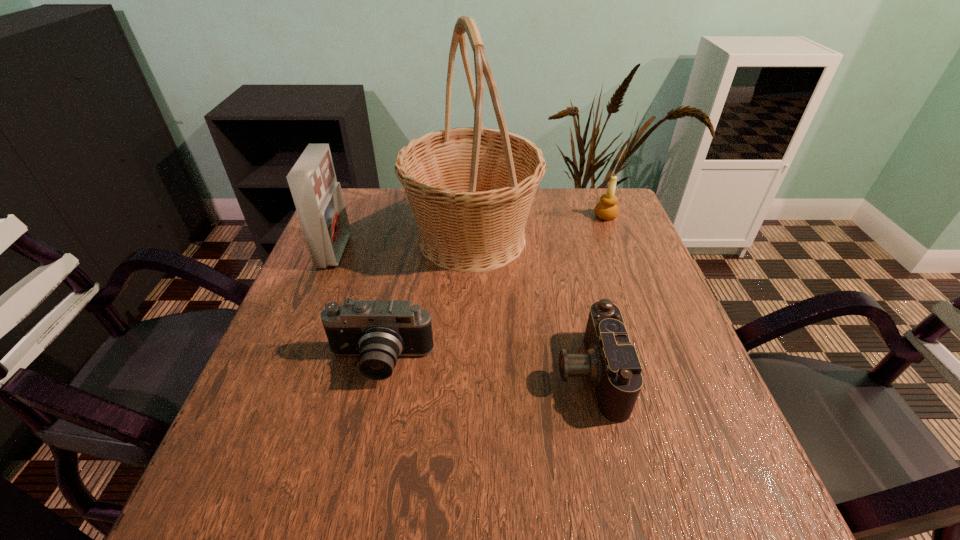
Identify the location of free location that satisfies the following two spatial constraints: 1. on the front side of the candle_holder; 2. on the front-facing side of the leftmost object. Image resolution: width=960 pixels, height=540 pixels. (619, 251).